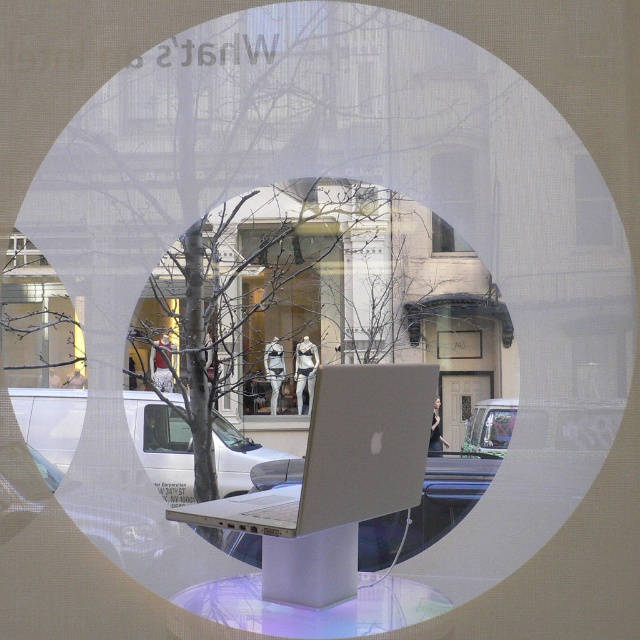
You are trying to take a photo of the clear glass window at upper center through the silver metallic laptop at center. Will the laptop block your view of the window?

The silver metallic laptop at center is in front of the clear glass window at upper center, so yes, the laptop will block your view of the window.

You are a delivery person trying to deliver a package to the silver metallic laptop at center. The package can only be delivered through the clear glass window at upper center. Can you deliver the package if the package requires a minimum distance of 30 centimeters between the delivery point and the laptop to ensure safety?

The silver metallic laptop at center and the clear glass window at upper center are 32.64 centimeters apart. Since the required minimum distance is 30 centimeters, the package can be safely delivered through the clear glass window at upper center.

You are an interior designer trying to place a large painting that is 2 meters wide. You see the clear glass window at upper center and the metallic silver car at center in the scene. Which object can the painting fit in front of without blocking the view of the other object?

The large painting can be placed in front of the clear glass window at upper center because it is larger in size than the metallic silver car at center, so there is enough space to position the painting without obstructing the view of the car.